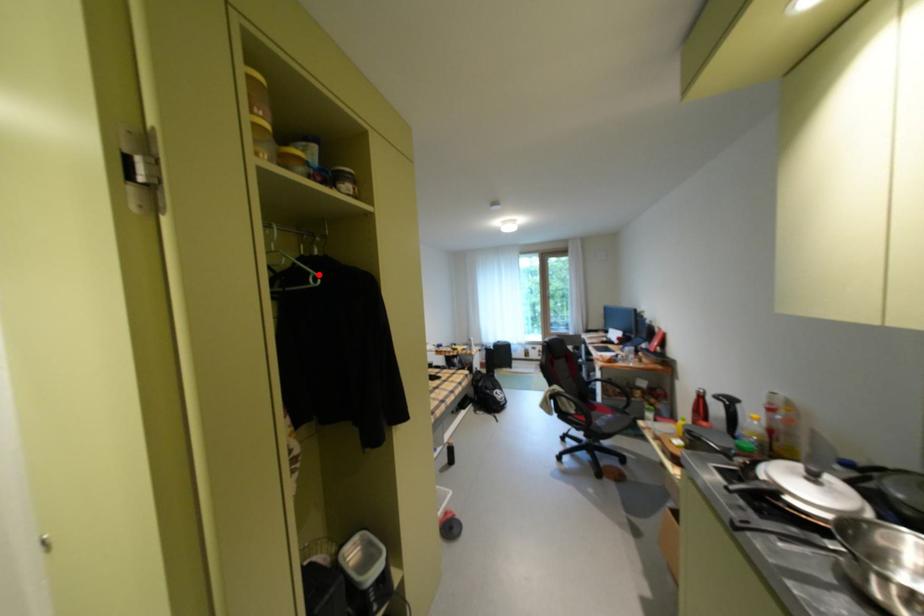
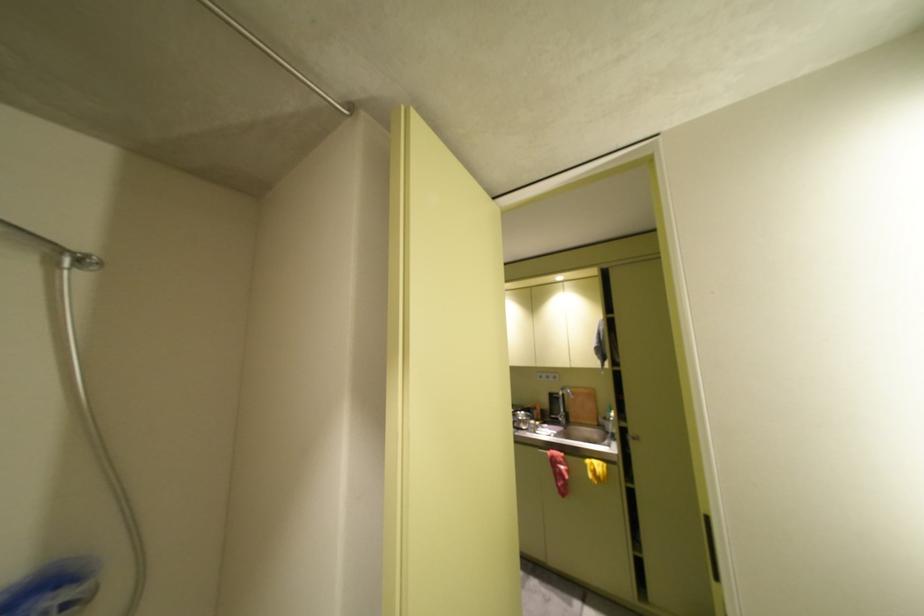
Question: I am providing you with two images of the same scene from different viewpoints. A red point is marked on the first image. At the location where the point appears in image 1, is it still visible in image 2?

Choices:
 (A) Yes
 (B) No

Answer: (B)